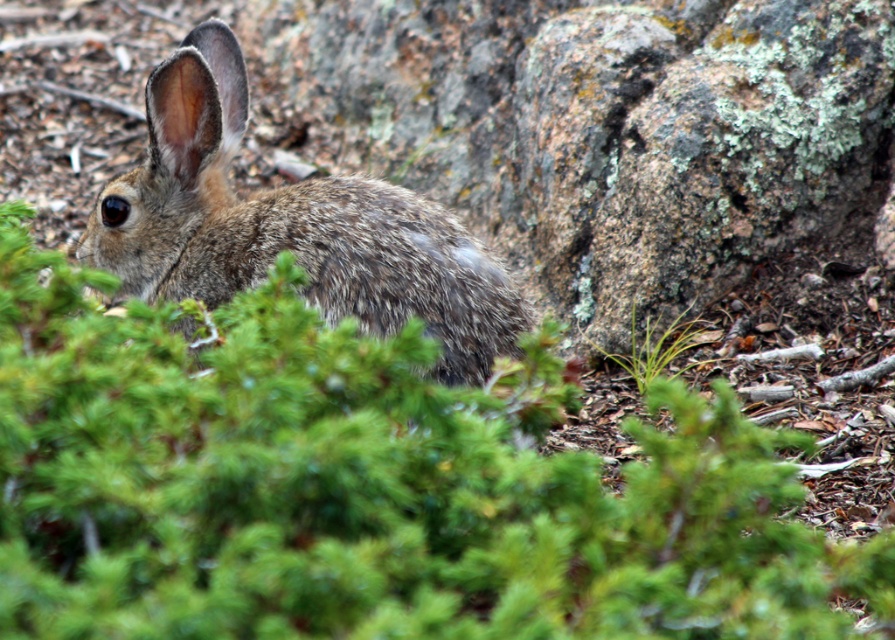
You are a small animal trying to cross from the fuzzy brown rabbit at center to the green leafy plant at center. The path is narrow and you can only move forward if there is at least 40 inches of space between them. Based on the scene, do you have enough space to move safely?

The distance between the fuzzy brown rabbit at center and the green leafy plant at center is 39.32 inches, which is slightly less than the required 40 inches. Therefore, there isn not enough space to move safely through the narrow path.

Based on the scene description, which object is taller between the fuzzy brown rabbit at center and the green leafy plant at center?

The fuzzy brown rabbit at center is taller than the green leafy plant at center according to the description.

You are a photographer trying to capture the fuzzy brown rabbit at center. There is a green leafy plant at center blocking your view. Can you see the rabbit clearly through the plant?

The fuzzy brown rabbit at center is in front of the green leafy plant at center, so the rabbit is blocking the view of the plant but you can see the rabbit clearly without obstruction from the plant.